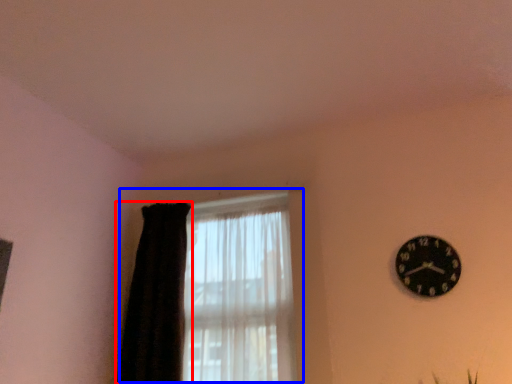
Question: Which object appears closest to the camera in this image, curtain (highlighted by a red box) or window (highlighted by a blue box)?

Choices:
 (A) curtain
 (B) window

Answer: (B)